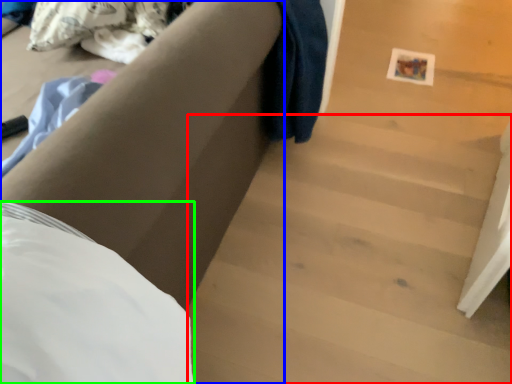
Question: Considering the real-world distances, which object is closest to stairwell (highlighted by a red box)? furniture (highlighted by a blue box) or sheet (highlighted by a green box).

Choices:
 (A) furniture
 (B) sheet

Answer: (A)